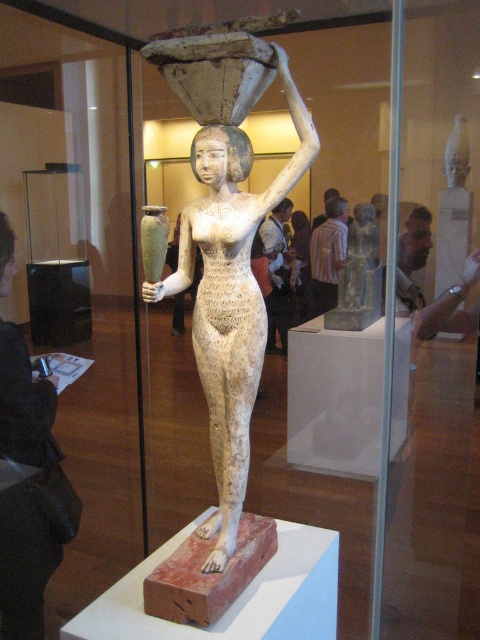
Question: Does white stone statue at center appear over black leather jacket at lower left?

Choices:
 (A) yes
 (B) no

Answer: (A)

Question: Considering the real-world distances, which object is farthest from the white stone vase at upper right?

Choices:
 (A) gray stone statue at center
 (B) white stone statue at center
 (C) black leather jacket at lower left

Answer: (C)

Question: Which point is farther to the camera?

Choices:
 (A) black leather jacket at lower left
 (B) white stone statue at center
 (C) white stone vase at upper right
 (D) gray stone statue at center

Answer: (C)

Question: Which object is closer to the camera taking this photo?

Choices:
 (A) white stone vase at upper right
 (B) black leather jacket at lower left
 (C) white stone statue at center

Answer: (C)

Question: Considering the relative positions of black leather jacket at lower left and white stone vase at upper right in the image provided, where is black leather jacket at lower left located with respect to white stone vase at upper right?

Choices:
 (A) left
 (B) right

Answer: (A)

Question: Where is white stone statue at center located in relation to black leather jacket at lower left in the image?

Choices:
 (A) right
 (B) left

Answer: (A)